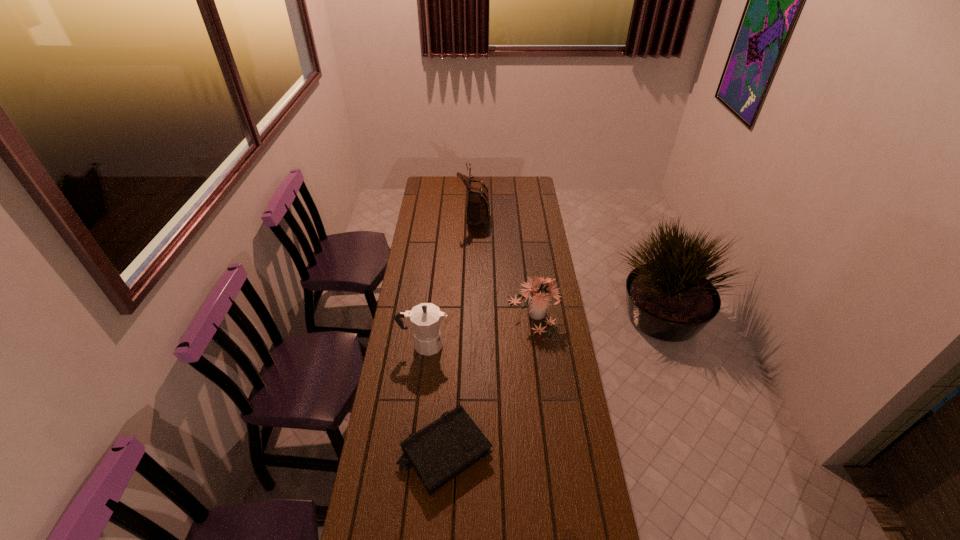
Find the location of `vacant space that is in between the tallest object and the coffeepot`. vacant space that is in between the tallest object and the coffeepot is located at coordinates click(449, 279).

I want to click on free area in between the coffeepot and the shoulder bag, so click(449, 279).

Select which object appears as the third closest to the tallest object. Please provide its 2D coordinates. Your answer should be formatted as a tuple, i.e. [(x, y)], where the tuple contains the x and y coordinates of a point satisfying the conditions above.

[(439, 452)]

Locate which object ranks third in proximity to the coffeepot. Please provide its 2D coordinates. Your answer should be formatted as a tuple, i.e. [(x, y)], where the tuple contains the x and y coordinates of a point satisfying the conditions above.

[(478, 209)]

The image size is (960, 540). I want to click on free space in the image that satisfies the following two spatial constraints: 1. on the front-facing side of the tallest object; 2. on the back side of the bouquet, so click(473, 313).

At what (x,y) coordinates should I click in order to perform the action: click on free space that satisfies the following two spatial constraints: 1. on the back side of the nearest object; 2. on the right side of the rightmost object. Please return your answer as a coordinate pair (x, y). The height and width of the screenshot is (540, 960). Looking at the image, I should click on coord(453,313).

I want to click on vacant space that satisfies the following two spatial constraints: 1. on the front-facing side of the shoulder bag; 2. on the back side of the rightmost object, so click(473, 313).